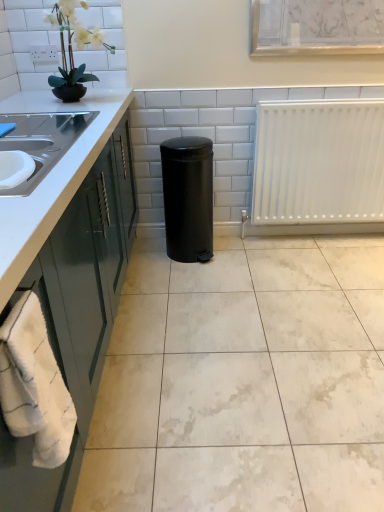
This screenshot has height=512, width=384. Find the location of `vacant area that is in front of black matte trash can at center`. vacant area that is in front of black matte trash can at center is located at coordinates (198, 279).